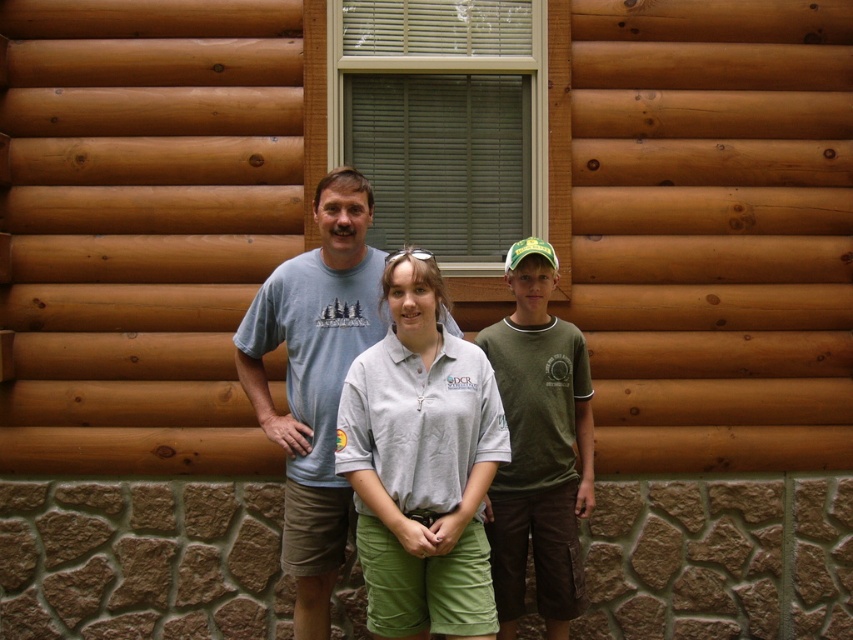
Question: Which of the following is the farthest from the observer?

Choices:
 (A) gray cotton shirt at center
 (B) light blue t-shirt at center

Answer: (B)

Question: Does gray cotton shirt at center have a larger size compared to light blue t-shirt at center?

Choices:
 (A) no
 (B) yes

Answer: (A)

Question: Which of the following is the farthest from the observer?

Choices:
 (A) gray cotton shirt at center
 (B) light blue t-shirt at center

Answer: (B)

Question: Is light blue t-shirt at center to the right of green cotton shirt at center from the viewer's perspective?

Choices:
 (A) no
 (B) yes

Answer: (A)

Question: Does gray cotton shirt at center appear under light blue t-shirt at center?

Choices:
 (A) yes
 (B) no

Answer: (A)

Question: Considering the real-world distances, which object is farthest from the green cotton shirt at center?

Choices:
 (A) light blue t-shirt at center
 (B) gray cotton shirt at center

Answer: (A)